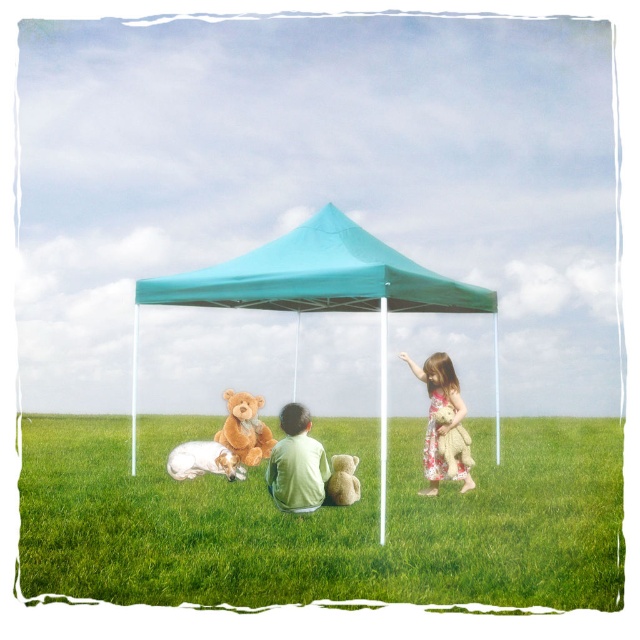
Question: Among these objects, which one is nearest to the camera?

Choices:
 (A) white fur dog at lower center
 (B) fuzzy beige teddy bear at lower right
 (C) fuzzy beige teddy bear at lower center
 (D) brown plush teddy bear at lower center

Answer: (C)

Question: Which object is closer to the camera taking this photo?

Choices:
 (A) fuzzy beige teddy bear at lower right
 (B) floral dress at right

Answer: (B)

Question: Which point is closer to the camera?

Choices:
 (A) (259, 435)
 (B) (168, 468)
 (C) (449, 406)

Answer: (C)

Question: Is soft green grass at center smaller than teal fabric tent at center?

Choices:
 (A) yes
 (B) no

Answer: (A)

Question: Does soft green grass at center appear on the right side of fuzzy beige teddy bear at lower center?

Choices:
 (A) no
 (B) yes

Answer: (A)

Question: Can you confirm if floral dress at right is positioned to the left of white fur dog at lower center?

Choices:
 (A) yes
 (B) no

Answer: (B)